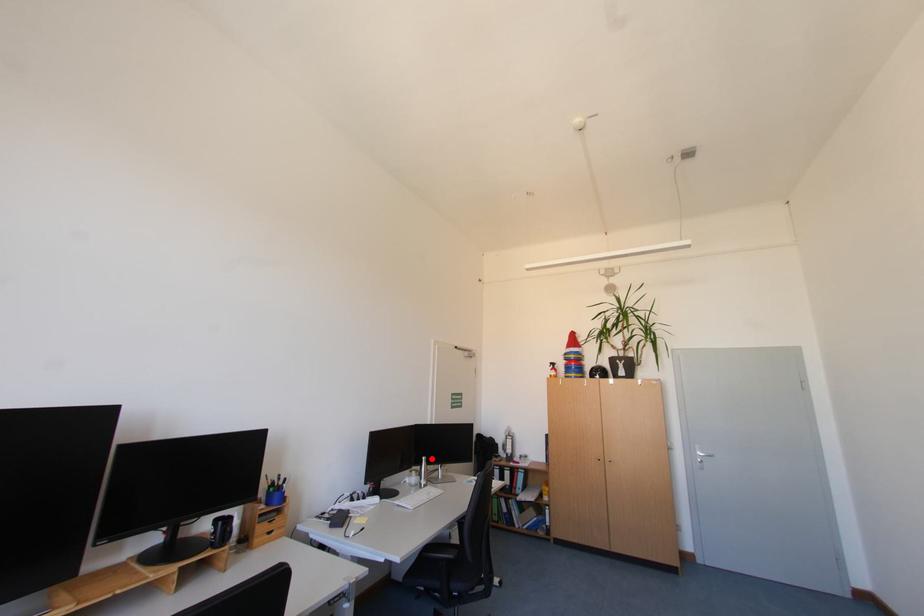
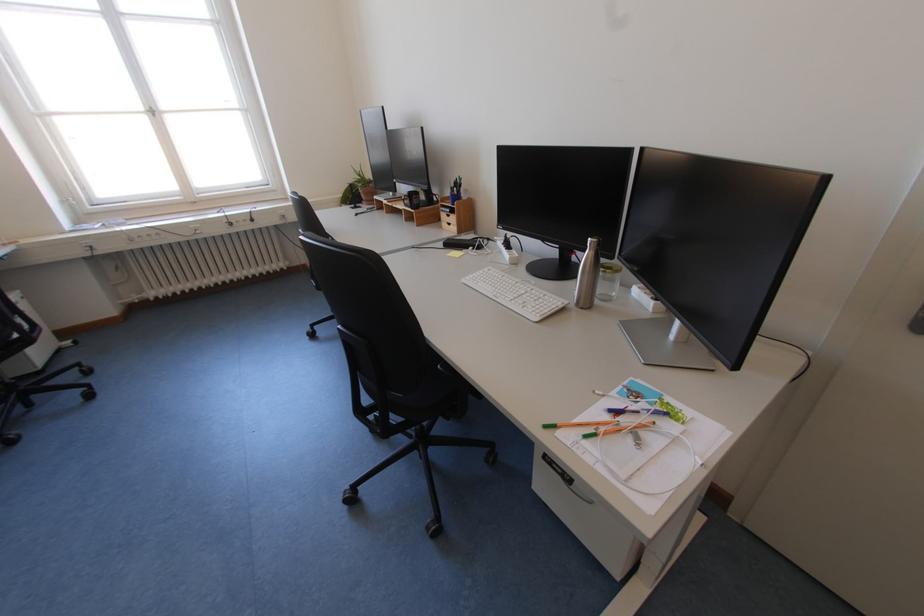
Locate, in the second image, the point that corresponds to the highlighted location in the first image.

(599, 240)